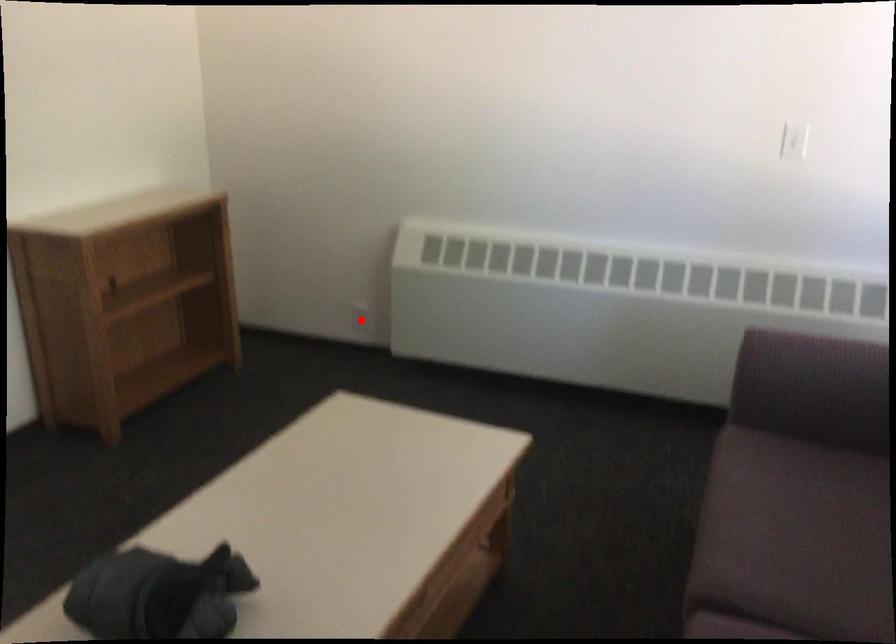
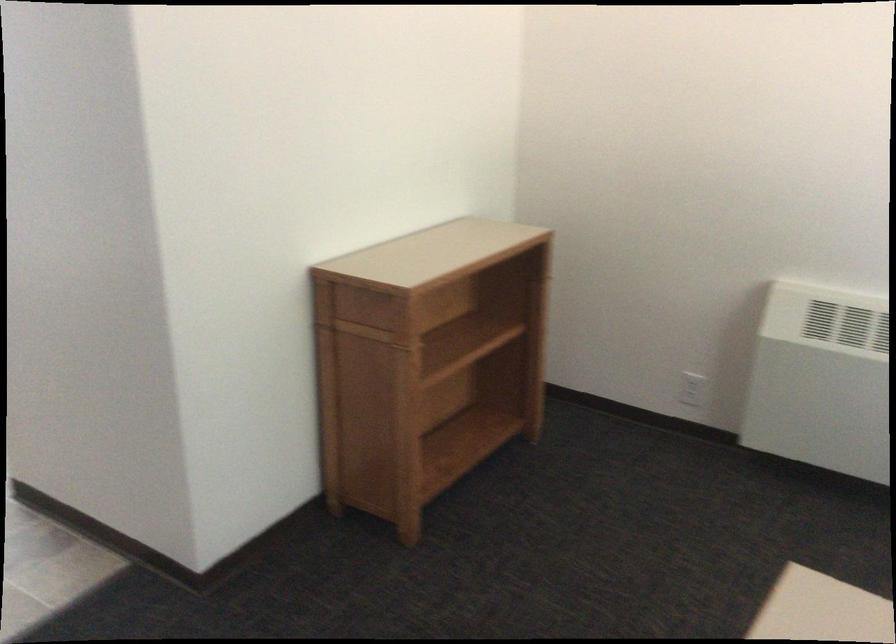
Question: I am providing you with two images of the same scene from different viewpoints. A red point is shown in image1. For the corresponding object point in image2, is it positioned nearer or farther from the camera?

Choices:
 (A) Nearer
 (B) Farther

Answer: (A)